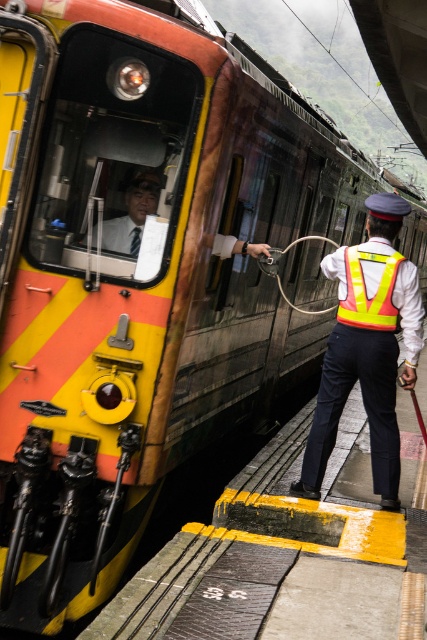
Is point (348, 269) farther from camera compared to point (119, 221)?

That is True.

What do you see at coordinates (365, 291) in the screenshot? I see `yellow reflective safety vest at center` at bounding box center [365, 291].

The height and width of the screenshot is (640, 427). Find the location of `yellow reflective safety vest at center`. yellow reflective safety vest at center is located at coordinates (365, 291).

Is reflective yellow vest at center taller than yellow reflective safety vest at center?

Indeed, reflective yellow vest at center has a greater height compared to yellow reflective safety vest at center.

Is point (357, 323) more distant than point (347, 246)?

No, it is not.

Locate an element on the screen. reflective yellow vest at center is located at coordinates (368, 348).

Who is lower down, reflective yellow vest at center or matte black tie at center?

reflective yellow vest at center is below.

Where is `reflective yellow vest at center`? reflective yellow vest at center is located at coordinates (368, 348).

Where is `reflective yellow vest at center`? The image size is (427, 640). reflective yellow vest at center is located at coordinates (368, 348).